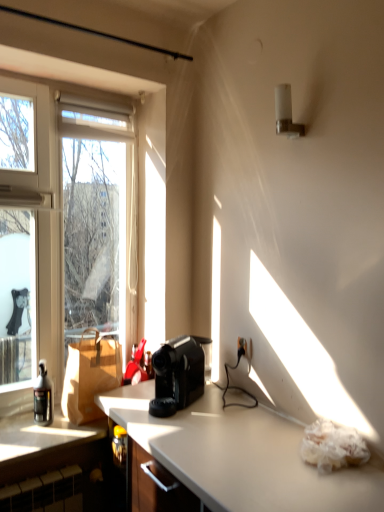
Question: Would you say brown paper bag at left is a long distance from black plastic coffee maker at center?

Choices:
 (A) yes
 (B) no

Answer: (B)

Question: Is brown paper bag at left outside black plastic coffee maker at center?

Choices:
 (A) yes
 (B) no

Answer: (A)

Question: Is brown paper bag at left aimed at black plastic coffee maker at center?

Choices:
 (A) yes
 (B) no

Answer: (B)

Question: Is brown paper bag at left taller than black plastic coffee maker at center?

Choices:
 (A) yes
 (B) no

Answer: (A)

Question: Is brown paper bag at left surrounding black plastic coffee maker at center?

Choices:
 (A) yes
 (B) no

Answer: (B)

Question: Considering the relative sizes of brown paper bag at left and black plastic coffee maker at center in the image provided, is brown paper bag at left shorter than black plastic coffee maker at center?

Choices:
 (A) yes
 (B) no

Answer: (B)

Question: Can you confirm if black plastic coffee maker at center is bigger than transparent glass window at left?

Choices:
 (A) no
 (B) yes

Answer: (A)

Question: Can you confirm if black plastic coffee maker at center is shorter than transparent glass window at left?

Choices:
 (A) no
 (B) yes

Answer: (B)

Question: Is black plastic coffee maker at center not close to transparent glass window at left?

Choices:
 (A) yes
 (B) no

Answer: (B)

Question: Can you confirm if black plastic coffee maker at center is positioned to the left of transparent glass window at left?

Choices:
 (A) yes
 (B) no

Answer: (B)

Question: From the image's perspective, is black plastic coffee maker at center on transparent glass window at left?

Choices:
 (A) no
 (B) yes

Answer: (A)

Question: Is black plastic coffee maker at center looking in the opposite direction of transparent glass window at left?

Choices:
 (A) yes
 (B) no

Answer: (B)

Question: Considering the relative sizes of brown paper bag at left and transparent glass window at left in the image provided, is brown paper bag at left smaller than transparent glass window at left?

Choices:
 (A) no
 (B) yes

Answer: (B)